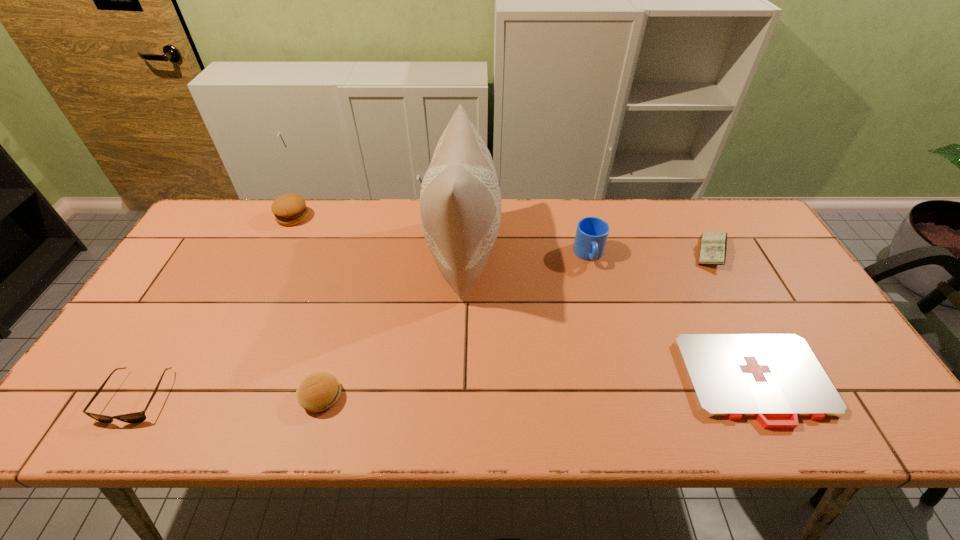
The width and height of the screenshot is (960, 540). Identify the location of patty located in the near edge section of the desktop. (318, 392).

This screenshot has height=540, width=960. Identify the location of sunglasses present at the near edge. (137, 417).

The width and height of the screenshot is (960, 540). Find the location of `the first-aid kit at the near edge`. the first-aid kit at the near edge is located at coordinates click(730, 375).

You are a GUI agent. You are given a task and a screenshot of the screen. Output one action in this format:
    pyautogui.click(x=<x>, y=<y>)
    Task: Click on the object that is at the left edge
    This screenshot has height=540, width=960.
    Given the screenshot: What is the action you would take?
    pyautogui.click(x=137, y=417)

Where is `diary present at the right edge`? The height and width of the screenshot is (540, 960). diary present at the right edge is located at coordinates (713, 247).

At what (x,y) coordinates should I click in order to perform the action: click on the first-aid kit present at the right edge. Please return your answer as a coordinate pair (x, y). Image resolution: width=960 pixels, height=540 pixels. Looking at the image, I should click on (730, 375).

Where is `object located at the near left corner`? object located at the near left corner is located at coordinates (137, 417).

Locate an element on the screen. The width and height of the screenshot is (960, 540). object that is positioned at the far right corner is located at coordinates (713, 247).

Where is `object at the near right corner`? The image size is (960, 540). object at the near right corner is located at coordinates (730, 375).

Locate an element on the screen. The width and height of the screenshot is (960, 540). free location at the far edge is located at coordinates (682, 226).